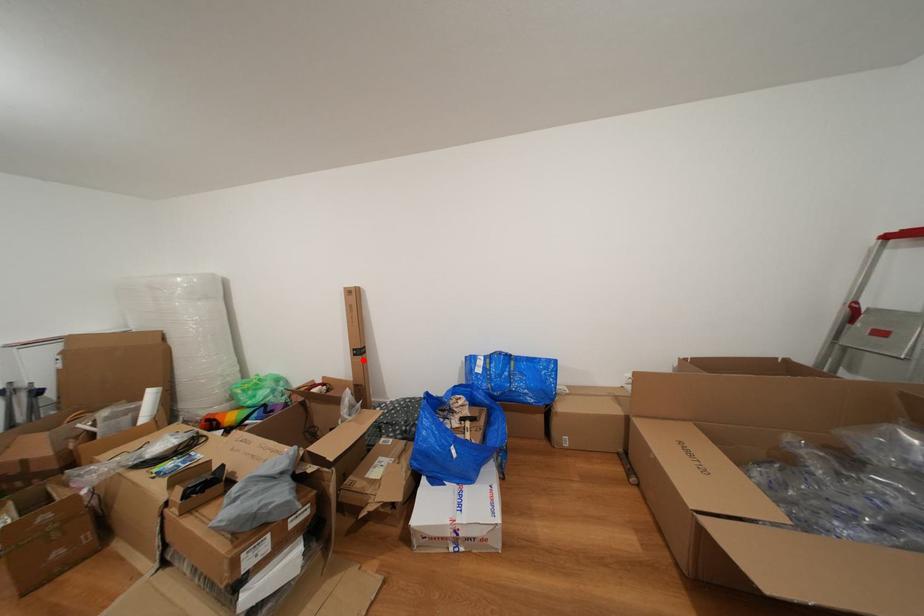
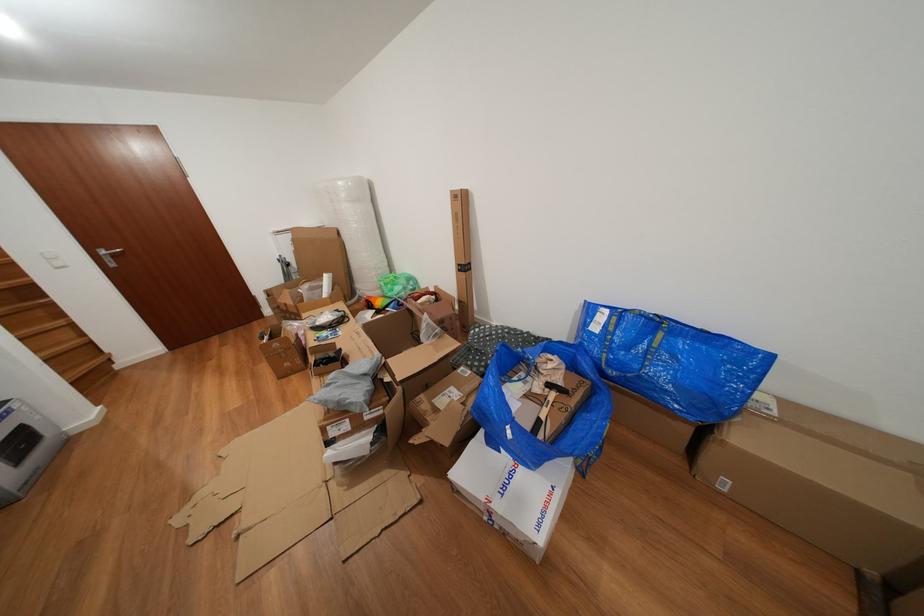
Question: A red point is marked in image1. In image2, is the corresponding 3D point closer to the camera or farther? Reply with the corresponding letter.

Choices:
 (A) The corresponding 3D point is closer.
 (B) The corresponding 3D point is farther.

Answer: (A)